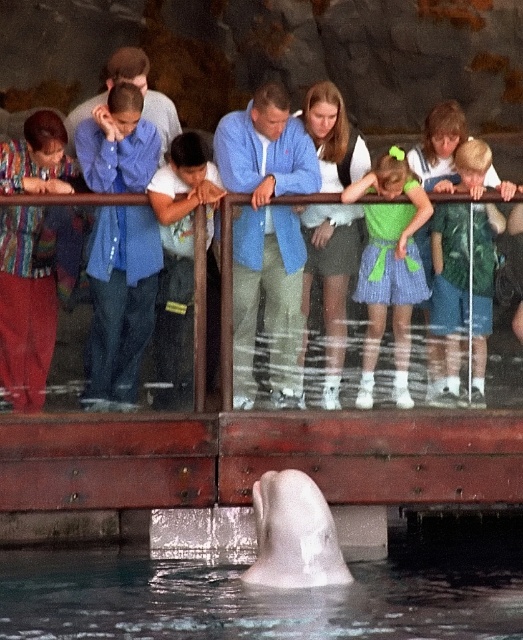
Who is taller, clear water at dolphin center or white smooth dolphin at lower center?

Standing taller between the two is white smooth dolphin at lower center.

Between clear water at dolphin center and white smooth dolphin at lower center, which one has less height?

Standing shorter between the two is clear water at dolphin center.

Where is `clear water at dolphin center`? The width and height of the screenshot is (523, 640). clear water at dolphin center is located at coordinates (275, 589).

Is blue cotton shirt at center below white smooth dolphin at lower center?

No.

Can you confirm if blue cotton shirt at center is thinner than white smooth dolphin at lower center?

In fact, blue cotton shirt at center might be wider than white smooth dolphin at lower center.

Who is more distant from viewer, (243, 131) or (297, 502)?

The point (243, 131) is more distant.

Locate an element on the screen. blue cotton shirt at center is located at coordinates (267, 236).

Which is behind, point (223, 141) or point (448, 236)?

The point (223, 141) is more distant.

Does blue cotton shirt at center appear under green fabric dress at center?

No, blue cotton shirt at center is not below green fabric dress at center.

Between point (243, 365) and point (456, 253), which one is positioned in front?

Point (243, 365)

Locate an element on the screen. The image size is (523, 640). blue cotton shirt at center is located at coordinates [x=267, y=236].